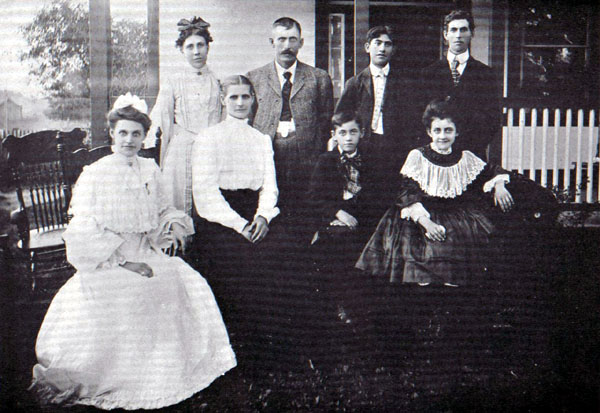
Identify the location of chair. (46, 220).